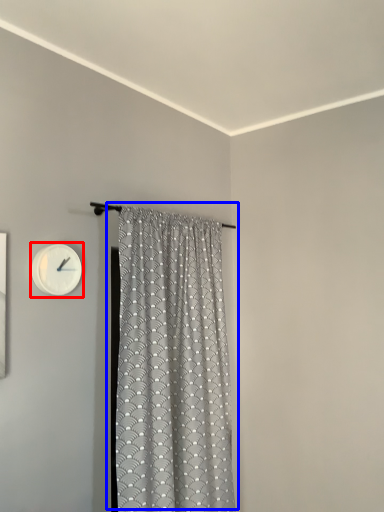
Question: Which object appears closest to the camera in this image, wall clock (highlighted by a red box) or curtain (highlighted by a blue box)?

Choices:
 (A) wall clock
 (B) curtain

Answer: (B)